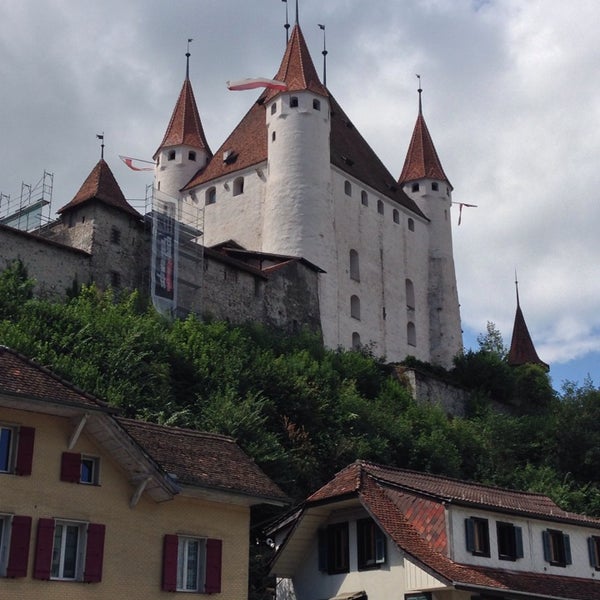
Locate an element on the screen. The image size is (600, 600). frame is located at coordinates (26, 198).